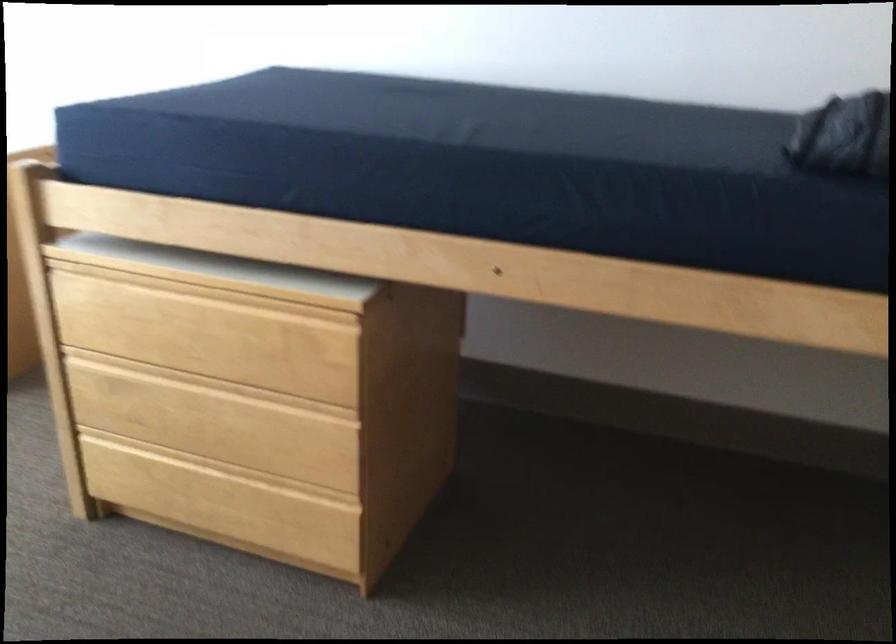
This screenshot has height=644, width=896. Identify the location of the top drawer handle. (207, 469).